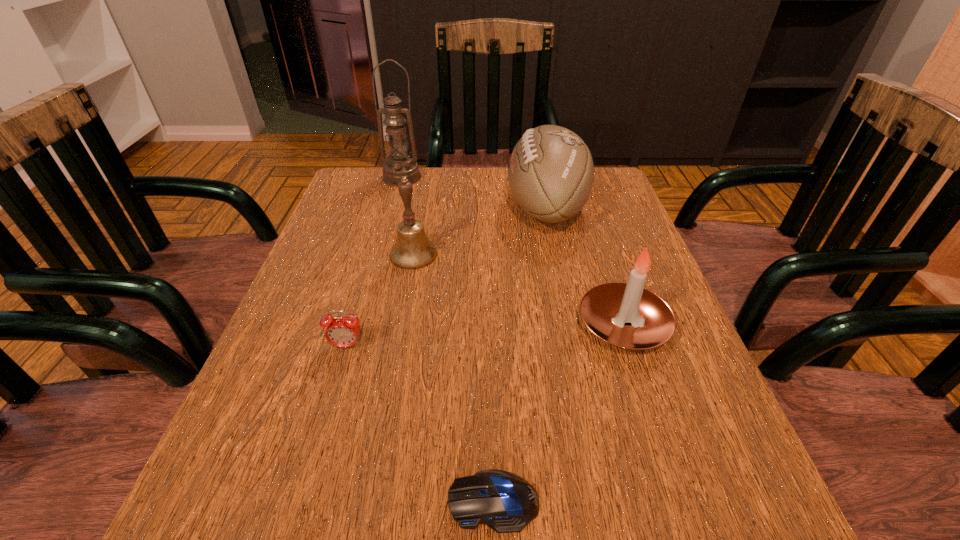
The width and height of the screenshot is (960, 540). Identify the location of vacant space situated 0.400m on the laces of the football (American). (346, 208).

Where is `vacant space located on the front of the bell`? Image resolution: width=960 pixels, height=540 pixels. vacant space located on the front of the bell is located at coordinates (391, 376).

At what (x,y) coordinates should I click in order to perform the action: click on free location located 0.130m on the front of the candle. Please return your answer as a coordinate pair (x, y). Image resolution: width=960 pixels, height=540 pixels. Looking at the image, I should click on (659, 433).

You are a GUI agent. You are given a task and a screenshot of the screen. Output one action in this format:
    pyautogui.click(x=<x>, y=<y>)
    Task: Click on the free location located 0.140m on the face of the fifth tallest object
    Image resolution: width=960 pixels, height=540 pixels.
    Given the screenshot: What is the action you would take?
    pyautogui.click(x=324, y=426)

The height and width of the screenshot is (540, 960). I want to click on vacant space located 0.120m on the button side of the shortest object, so (x=355, y=501).

At what (x,y) coordinates should I click in order to perform the action: click on blank space located on the button side of the shortest object. Please return your answer as a coordinate pair (x, y). The image size is (960, 540). Looking at the image, I should click on (324, 501).

This screenshot has width=960, height=540. What are the coordinates of `free region located on the button side of the shortest object` in the screenshot? It's located at (348, 501).

Locate an element on the screen. oil lamp at the far edge is located at coordinates (400, 165).

At what (x,y) coordinates should I click in order to perform the action: click on football (American) that is at the far edge. Please return your answer as a coordinate pair (x, y). Looking at the image, I should click on (551, 172).

The height and width of the screenshot is (540, 960). Identify the location of object that is at the near edge. (505, 502).